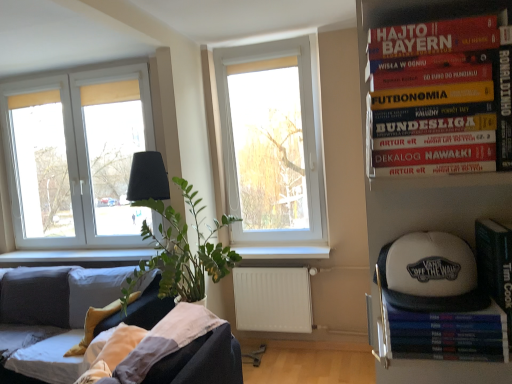
Where is `vacant space underneath white fabric baseball cap at right (from a real-world perspective)`? The height and width of the screenshot is (384, 512). vacant space underneath white fabric baseball cap at right (from a real-world perspective) is located at coordinates (444, 302).